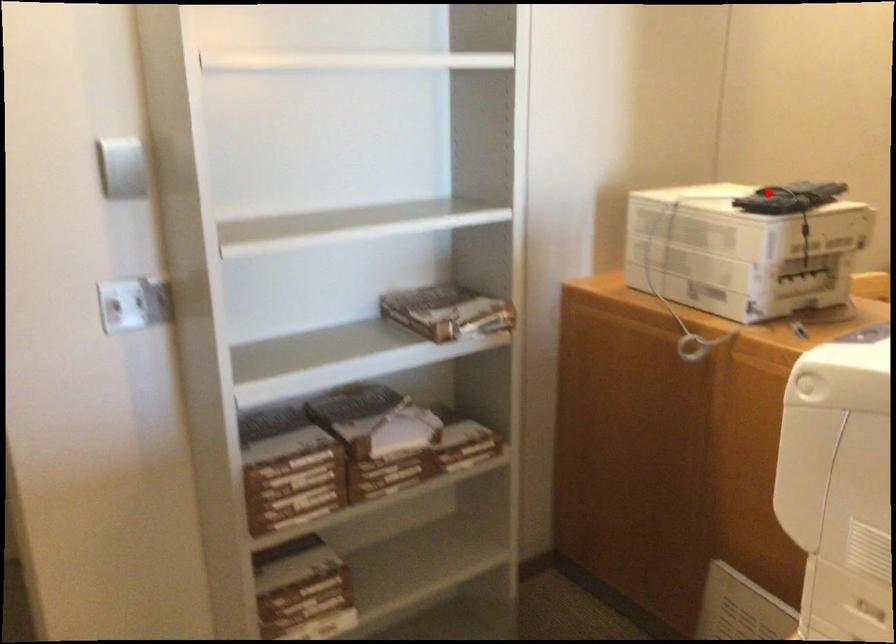
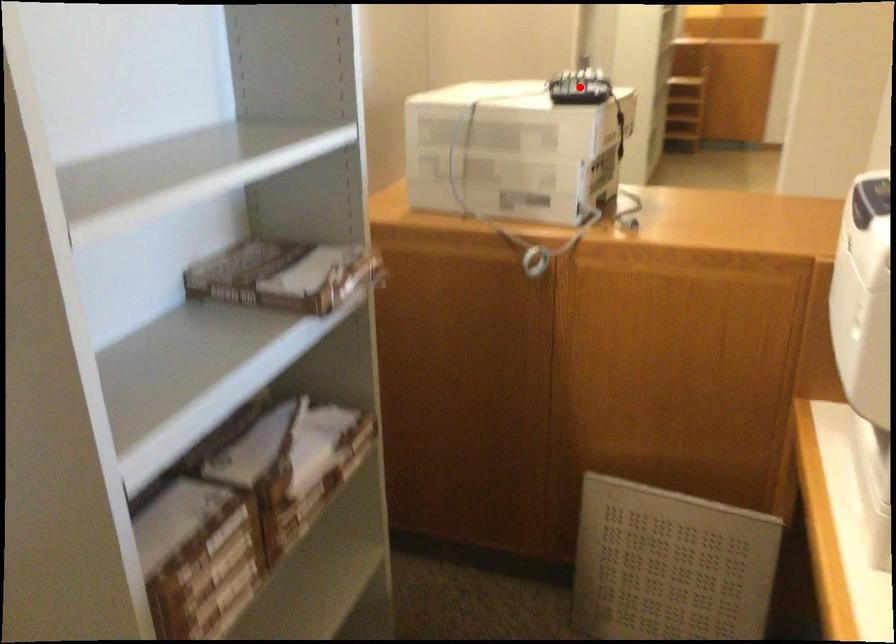
I am providing you with two images of the same scene from different viewpoints. A red point is marked on the first image and another point is marked on the second image. Is the red point in image1 aligned with the point shown in image2?

Yes